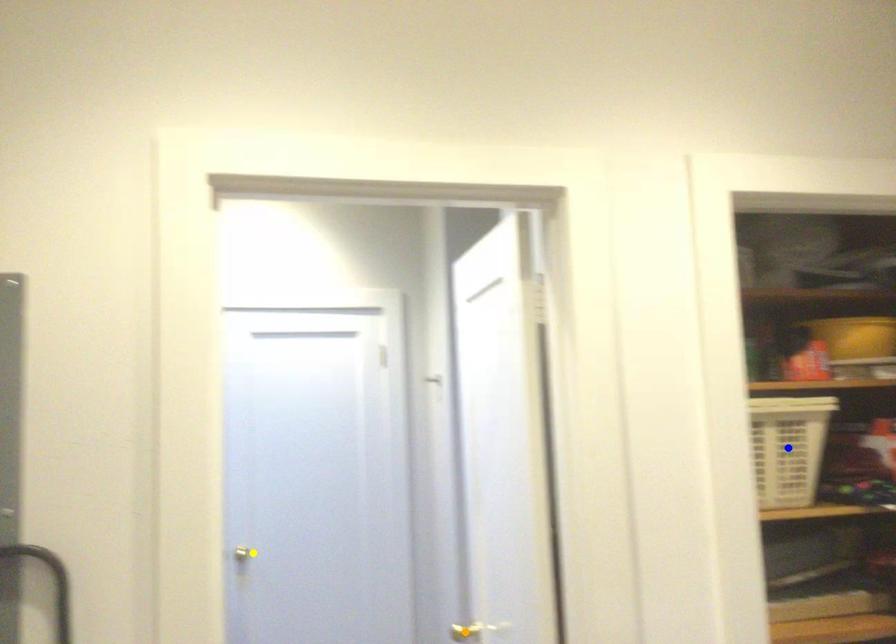
Order these from nearest to farthest:
blue point
orange point
yellow point

yellow point, orange point, blue point